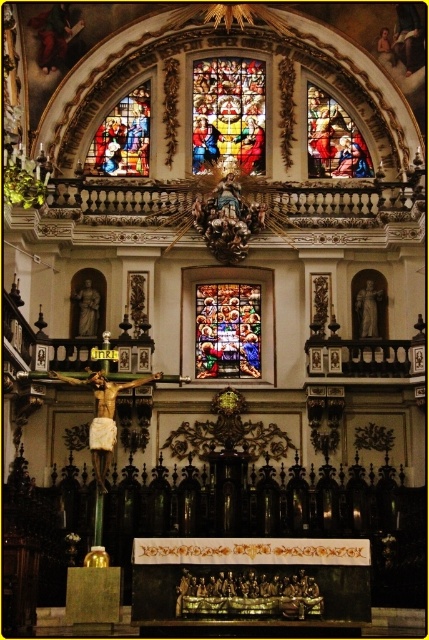
Between point (337, 173) and point (142, 145), which one is positioned behind?

The point (142, 145) is more distant.

Is stained glass window at upper center further to camera compared to stained glass window at upper left?

Yes, it is.

Does point (334, 122) come in front of point (105, 120)?

Yes, it is.

Find the location of `stained glass window at upper center`. stained glass window at upper center is located at coordinates (334, 140).

Can you confirm if stained glass at center is positioned below stained glass window at upper left?

Yes.

From the picture: How distant is stained glass at center from stained glass window at upper left?

stained glass at center is 15.07 meters from stained glass window at upper left.

Where is `stained glass at center`? stained glass at center is located at coordinates (227, 330).

Which of these two, stained glass at center or stained glass window at upper center, stands taller?

stained glass window at upper center is taller.

Where is `stained glass at center`? Image resolution: width=429 pixels, height=640 pixels. stained glass at center is located at coordinates (227, 330).

This screenshot has width=429, height=640. Describe the element at coordinates (227, 330) in the screenshot. I see `stained glass at center` at that location.

Where is `stained glass at center`? This screenshot has height=640, width=429. stained glass at center is located at coordinates (227, 330).